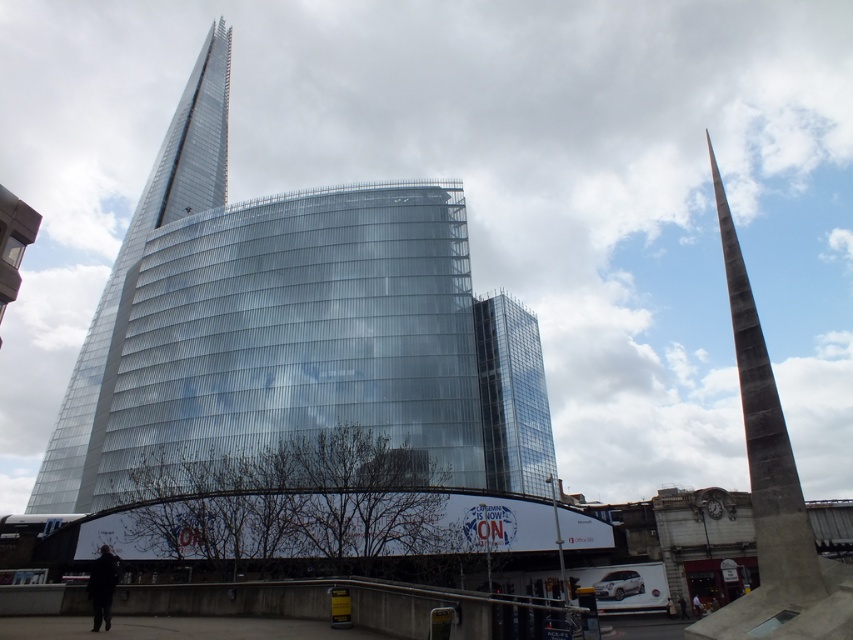
Does shiny glass spire at left appear on the right side of rustic concrete spire at right?

No, shiny glass spire at left is not to the right of rustic concrete spire at right.

Who is lower down, shiny glass spire at left or rustic concrete spire at right?

Positioned lower is rustic concrete spire at right.

This screenshot has height=640, width=853. Identify the location of shiny glass spire at left. (137, 275).